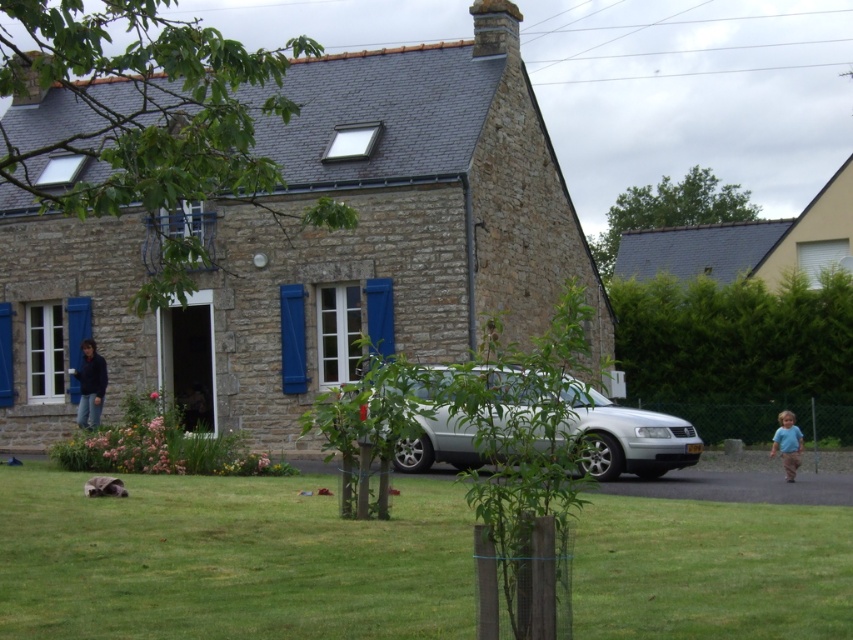
Is satin silver car at center thinner than gray slate roof at upper right?

Indeed, satin silver car at center has a lesser width compared to gray slate roof at upper right.

Is satin silver car at center smaller than gray slate roof at upper right?

Yes, satin silver car at center is smaller than gray slate roof at upper right.

In order to click on satin silver car at center in this screenshot , I will do `click(625, 436)`.

Find the location of a particular element. The height and width of the screenshot is (640, 853). satin silver car at center is located at coordinates (625, 436).

Can you confirm if green grass at lower center is positioned to the right of gray slate roof at upper right?

In fact, green grass at lower center is to the left of gray slate roof at upper right.

Is point (3, 563) farther from viewer compared to point (769, 250)?

No, it is not.

The image size is (853, 640). Find the location of `green grass at lower center`. green grass at lower center is located at coordinates (228, 560).

Locate an element on the screen. This screenshot has width=853, height=640. dark blue jeans at lower left is located at coordinates (90, 385).

Does dark blue jeans at lower left have a greater height compared to blue cotton shirt at lower right?

Indeed, dark blue jeans at lower left has a greater height compared to blue cotton shirt at lower right.

Is point (86, 378) less distant than point (790, 467)?

No, it is behind (790, 467).

Locate an element on the screen. The image size is (853, 640). dark blue jeans at lower left is located at coordinates (90, 385).